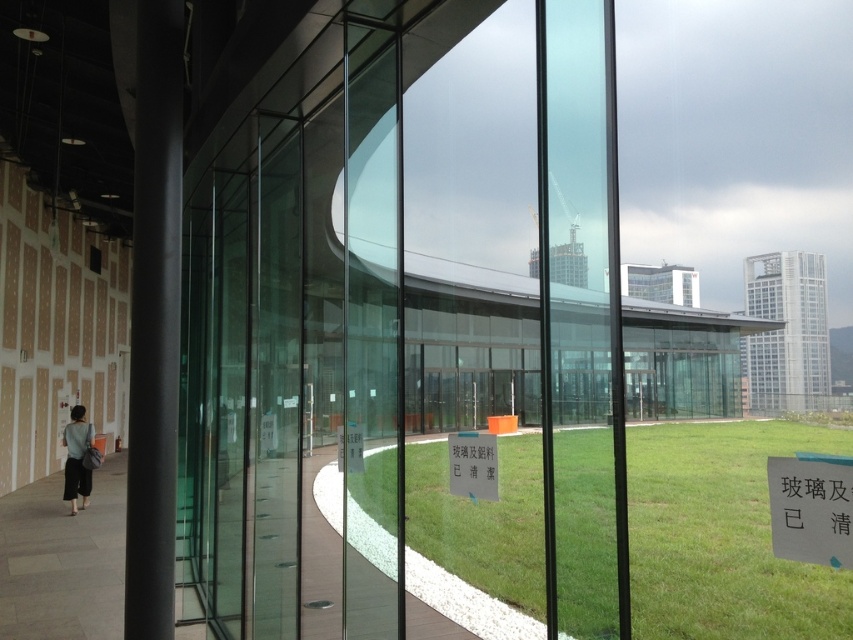
Question: Is light gray concrete walkway at lower left to the left of matte gray skirt at lower left from the viewer's perspective?

Choices:
 (A) yes
 (B) no

Answer: (B)

Question: Which point is farther to the camera?

Choices:
 (A) light gray concrete walkway at lower left
 (B) transparent glass door at center
 (C) white paper sign at lower right

Answer: (A)

Question: Which object is positioned farthest from the smooth concrete walkway at center?

Choices:
 (A) green matte sign at center
 (B) transparent glass door at center
 (C) green grass at center

Answer: (A)

Question: Is green grass at center wider than matte gray skirt at lower left?

Choices:
 (A) yes
 (B) no

Answer: (A)

Question: Can you confirm if transparent glass door at center is positioned to the left of white paper sign at center?

Choices:
 (A) yes
 (B) no

Answer: (B)

Question: Which point appears farthest from the camera in this image?

Choices:
 (A) (345, 54)
 (B) (669, 476)
 (C) (83, 628)
 (D) (76, 419)

Answer: (B)